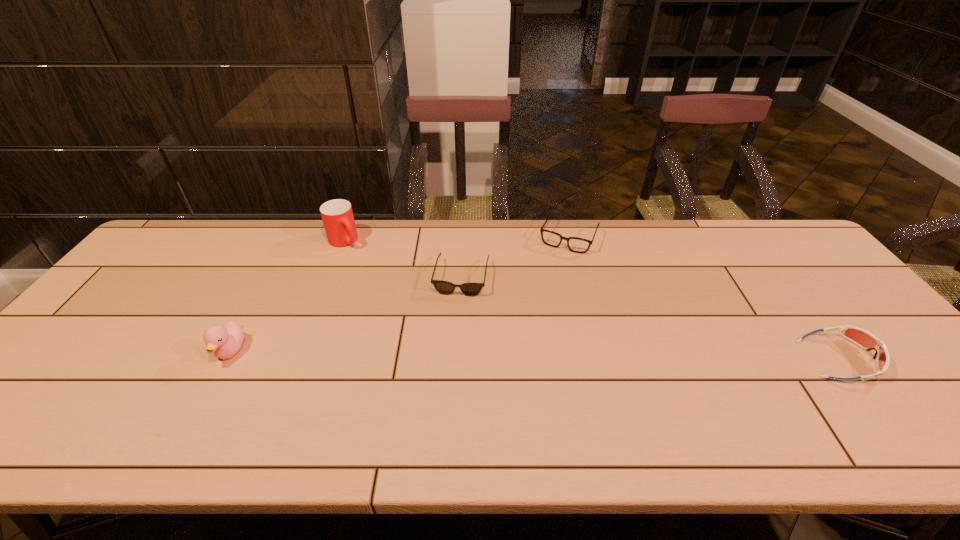
The image size is (960, 540). In order to click on the leftmost object in this screenshot , I will do `click(224, 342)`.

Identify the location of duckling. (224, 342).

Where is `goggles`? This screenshot has width=960, height=540. goggles is located at coordinates (863, 338).

You are a GUI agent. You are given a task and a screenshot of the screen. Output one action in this format:
    pyautogui.click(x=<x>, y=<y>)
    Task: Click on the spectacles
    Image resolution: width=960 pixels, height=540 pixels.
    Given the screenshot: What is the action you would take?
    pyautogui.click(x=577, y=245)

Identify the location of the third nearest object. (444, 287).

Where is `sunglasses`? This screenshot has width=960, height=540. sunglasses is located at coordinates (444, 287).

The width and height of the screenshot is (960, 540). What are the coordinates of `the fourth object from right to left` in the screenshot? It's located at (337, 215).

The height and width of the screenshot is (540, 960). In order to click on cup in this screenshot , I will do `click(337, 215)`.

Where is `blank space located on the front-facing side of the second tallest object`? Image resolution: width=960 pixels, height=540 pixels. blank space located on the front-facing side of the second tallest object is located at coordinates (204, 402).

Locate an element on the screen. The image size is (960, 540). blank area located on the front-facing side of the rightmost object is located at coordinates (900, 359).